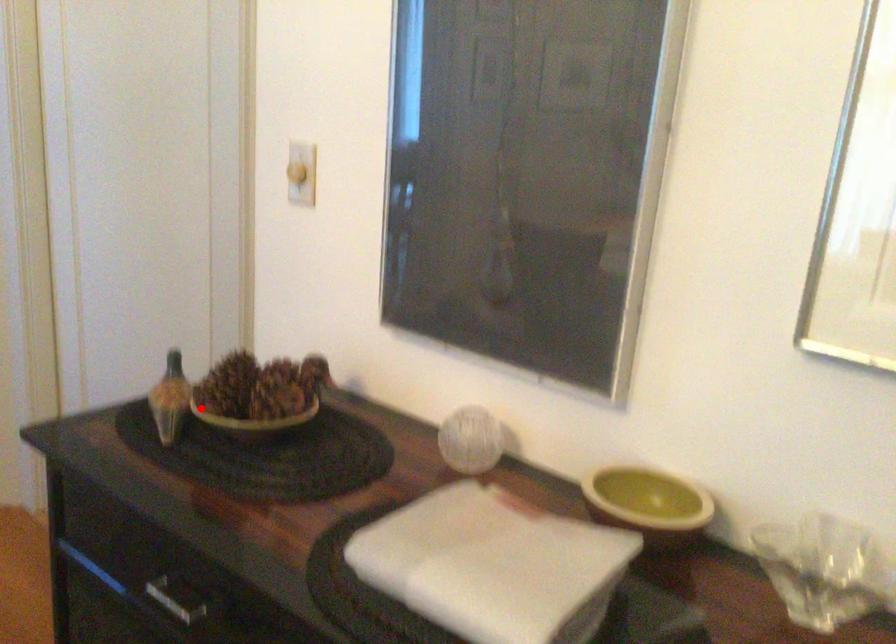
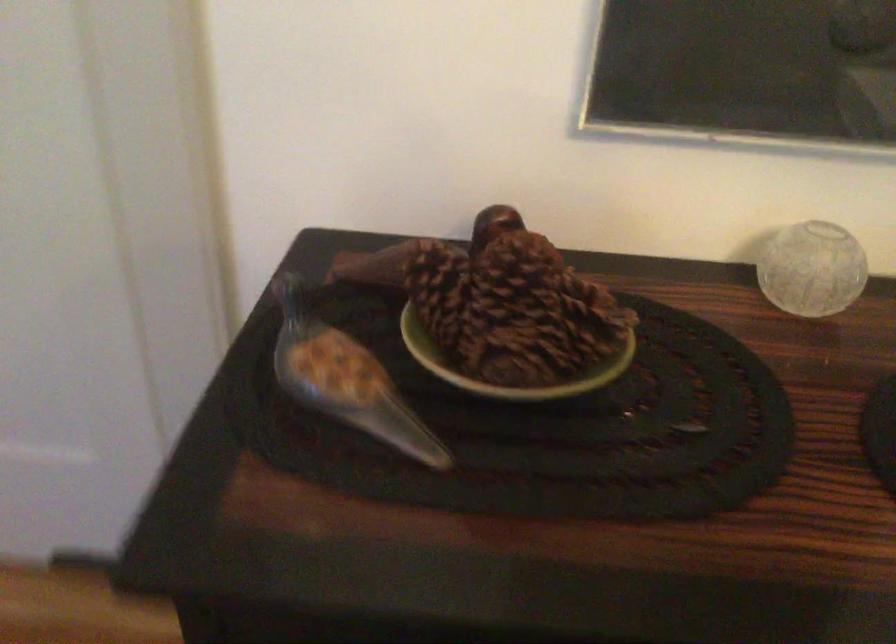
Question: I am providing you with two images of the same scene from different viewpoints. A red point is shown in image1. For the corresponding object point in image2, is it positioned nearer or farther from the camera?

Choices:
 (A) Nearer
 (B) Farther

Answer: (A)